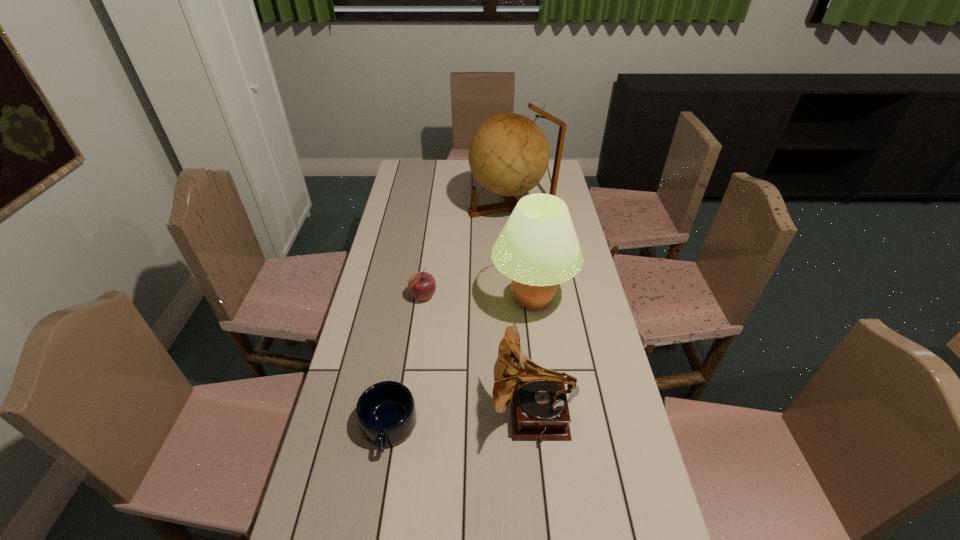
The height and width of the screenshot is (540, 960). I want to click on object identified as the closest to the shortest object, so click(x=539, y=408).